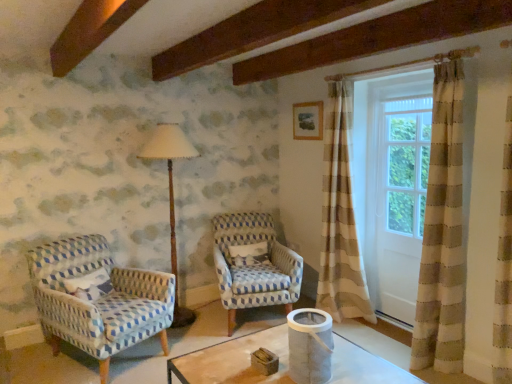
In order to face white fabric curtain at right, should I rotate leftwards or rightwards?

Rotate your view right by about 18.731°.

In order to face wooden floor lamp at left, should I rotate leftwards or rightwards?

To face it directly, rotate left by 11.015 degrees.

The image size is (512, 384). Describe the element at coordinates (98, 299) in the screenshot. I see `blue-patterned fabric chair at left, acting as the 2th chair starting from the right` at that location.

The width and height of the screenshot is (512, 384). What do you see at coordinates (253, 264) in the screenshot?
I see `blue and white woven chair at center, which appears as the 2th chair when viewed from the left` at bounding box center [253, 264].

What is the approximate width of blue and white woven chair at center, which appears as the 2th chair when viewed from the left?

blue and white woven chair at center, which appears as the 2th chair when viewed from the left, is 33.92 inches in width.

What is the approximate width of white wood screen door at right?

The width of white wood screen door at right is 4.09 inches.

Locate an element on the screen. This screenshot has width=512, height=384. white fabric curtain at right is located at coordinates (416, 197).

Is wooden picture frame at upper center situated inside white textured pillow at center or outside?

wooden picture frame at upper center lies outside white textured pillow at center.

Is wooden picture frame at upper center placed right next to white textured pillow at center?

No, wooden picture frame at upper center is not touching white textured pillow at center.

From the image's perspective, is wooden picture frame at upper center positioned above or below white textured pillow at center?

Clearly, from the image's perspective, wooden picture frame at upper center is above white textured pillow at center.

Where is `picture frame above the white textured pillow at center (from a real-world perspective)`? This screenshot has height=384, width=512. picture frame above the white textured pillow at center (from a real-world perspective) is located at coordinates (308, 121).

From the image's perspective, is wooden picture frame at upper center positioned above or below blue-patterned fabric chair at left, marked as the 1th chair in a left-to-right arrangement?

wooden picture frame at upper center is situated higher than blue-patterned fabric chair at left, marked as the 1th chair in a left-to-right arrangement, in the image.

Is wooden picture frame at upper center turned away from blue-patterned fabric chair at left, marked as the 1th chair in a left-to-right arrangement?

No, wooden picture frame at upper center is not facing away from blue-patterned fabric chair at left, marked as the 1th chair in a left-to-right arrangement.

From the image's perspective, which chair is the 2nd one below the wooden picture frame at upper center? Please provide its 2D coordinates.

[(98, 299)]

Between wooden picture frame at upper center and blue-patterned fabric chair at left, marked as the 1th chair in a left-to-right arrangement, which one has larger size?

With larger size is blue-patterned fabric chair at left, marked as the 1th chair in a left-to-right arrangement.

Is blue-patterned fabric chair at left, marked as the 1th chair in a left-to-right arrangement, oriented towards blue and white woven chair at center, which appears as the 2th chair when viewed from the left?

No, blue-patterned fabric chair at left, marked as the 1th chair in a left-to-right arrangement, is not turned towards blue and white woven chair at center, which appears as the 2th chair when viewed from the left.

Considering the relative positions of blue-patterned fabric chair at left, marked as the 1th chair in a left-to-right arrangement, and blue and white woven chair at center, which appears as the 2th chair when viewed from the left, in the image provided, is blue-patterned fabric chair at left, marked as the 1th chair in a left-to-right arrangement, to the left or to the right of blue and white woven chair at center, which appears as the 2th chair when viewed from the left,?

blue-patterned fabric chair at left, marked as the 1th chair in a left-to-right arrangement, is positioned on blue and white woven chair at center, which appears as the 2th chair when viewed from the left,'s left side.

Which of these two, blue-patterned fabric chair at left, marked as the 1th chair in a left-to-right arrangement, or blue and white woven chair at center, which appears as the 2th chair when viewed from the left, stands taller?

blue-patterned fabric chair at left, marked as the 1th chair in a left-to-right arrangement.

Is blue-patterned fabric chair at left, marked as the 1th chair in a left-to-right arrangement, thinner than blue and white woven chair at center, which appears as the 2th chair when viewed from the left?

In fact, blue-patterned fabric chair at left, marked as the 1th chair in a left-to-right arrangement, might be wider than blue and white woven chair at center, which appears as the 2th chair when viewed from the left.

At what (x,y) coordinates should I click in order to perform the action: click on window behind the blue-patterned fabric chair at left, marked as the 1th chair in a left-to-right arrangement. Please return your answer as a coordinate pair (x, y). The image size is (512, 384). Looking at the image, I should click on (416, 197).

Considering the sizes of objects white fabric curtain at right and blue-patterned fabric chair at left, marked as the 1th chair in a left-to-right arrangement, in the image provided, who is smaller, white fabric curtain at right or blue-patterned fabric chair at left, marked as the 1th chair in a left-to-right arrangement,?

Smaller between the two is white fabric curtain at right.

Is white fabric curtain at right aimed at blue-patterned fabric chair at left, acting as the 2th chair starting from the right?

No, white fabric curtain at right is not facing towards blue-patterned fabric chair at left, acting as the 2th chair starting from the right.

Is white fabric curtain at right touching wooden picture frame at upper center?

white fabric curtain at right is not next to wooden picture frame at upper center, and they're not touching.

Considering the sizes of objects white fabric curtain at right and wooden picture frame at upper center in the image provided, who is smaller, white fabric curtain at right or wooden picture frame at upper center?

wooden picture frame at upper center is smaller.

Between white fabric curtain at right and wooden picture frame at upper center, which one appears on the left side from the viewer's perspective?

wooden picture frame at upper center is more to the left.

Is blue and white woven chair at center, which appears as the 2th chair when viewed from the left, positioned with its back to white textured pillow at center?

Yes.

From the image's perspective, would you say blue and white woven chair at center, which appears as the 2th chair when viewed from the left, is positioned over white textured pillow at center?

No.

Considering the relative positions of blue and white woven chair at center, which appears as the 2th chair when viewed from the left, and white textured pillow at center in the image provided, is blue and white woven chair at center, which appears as the 2th chair when viewed from the left, to the right of white textured pillow at center from the viewer's perspective?

Indeed, blue and white woven chair at center, which appears as the 2th chair when viewed from the left, is positioned on the right side of white textured pillow at center.

Are blue and white woven chair at center, which appears as the 2th chair when viewed from the left, and white textured pillow at center far apart?

blue and white woven chair at center, which appears as the 2th chair when viewed from the left, is near white textured pillow at center, not far away.

Considering the sizes of wooden picture frame at upper center and blue and white woven chair at center, arranged as the 1th chair when viewed from the right, in the image, is wooden picture frame at upper center wider or thinner than blue and white woven chair at center, arranged as the 1th chair when viewed from the right,?

In the image, wooden picture frame at upper center appears to be more narrow than blue and white woven chair at center, arranged as the 1th chair when viewed from the right.

Is wooden picture frame at upper center oriented towards blue and white woven chair at center, arranged as the 1th chair when viewed from the right?

No.

From the image's perspective, is wooden picture frame at upper center beneath blue and white woven chair at center, which appears as the 2th chair when viewed from the left?

No, from the image's perspective, wooden picture frame at upper center is not below blue and white woven chair at center, which appears as the 2th chair when viewed from the left.

From a real-world perspective, relative to blue and white woven chair at center, which appears as the 2th chair when viewed from the left, is wooden picture frame at upper center vertically above or below?

Clearly, from a real-world perspective, wooden picture frame at upper center is above blue and white woven chair at center, which appears as the 2th chair when viewed from the left.

The height and width of the screenshot is (384, 512). I want to click on pillow lying in front of the wooden picture frame at upper center, so click(248, 254).

From the image's perspective, starting from the wooden picture frame at upper center, which chair is the 2nd one below? Please provide its 2D coordinates.

[(98, 299)]

When comparing their distances from wooden floor lamp at left, does blue and white woven chair at center, which appears as the 2th chair when viewed from the left, or blue-patterned fabric chair at left, acting as the 2th chair starting from the right, seem closer?

blue and white woven chair at center, which appears as the 2th chair when viewed from the left, is positioned closer to the anchor wooden floor lamp at left.

Looking at the image, which one is located closer to blue-patterned fabric chair at left, marked as the 1th chair in a left-to-right arrangement, white textured pillow at center or wooden picture frame at upper center?

white textured pillow at center.

Which object lies further to the anchor point white wood screen door at right, blue and white woven chair at center, which appears as the 2th chair when viewed from the left, or wooden floor lamp at left?

wooden floor lamp at left is further to white wood screen door at right.

Which object lies nearer to the anchor point wooden picture frame at upper center, blue-patterned fabric chair at left, acting as the 2th chair starting from the right, or white fabric curtain at right?

white fabric curtain at right is closer to wooden picture frame at upper center.

Considering their positions, is wooden floor lamp at left positioned closer to wooden picture frame at upper center than white wood screen door at right?

white wood screen door at right is positioned closer to the anchor wooden picture frame at upper center.

From the image, which object appears to be farther from white wood screen door at right, wooden picture frame at upper center or blue and white woven chair at center, arranged as the 1th chair when viewed from the right?

blue and white woven chair at center, arranged as the 1th chair when viewed from the right, is positioned further to the anchor white wood screen door at right.

Estimate the real-world distances between objects in this image. Which object is further from wooden picture frame at upper center, white textured pillow at center or blue and white woven chair at center, which appears as the 2th chair when viewed from the left?

Among the two, white textured pillow at center is located further to wooden picture frame at upper center.

Looking at the image, which one is located closer to wooden floor lamp at left, white textured pillow at center or blue-patterned fabric chair at left, marked as the 1th chair in a left-to-right arrangement?

white textured pillow at center lies closer to wooden floor lamp at left than the other object.

Identify the location of chair between blue-patterned fabric chair at left, marked as the 1th chair in a left-to-right arrangement, and white wood screen door at right. (253, 264).

Where is `pillow located between wooden floor lamp at left and white fabric curtain at right in the left-right direction`? The height and width of the screenshot is (384, 512). pillow located between wooden floor lamp at left and white fabric curtain at right in the left-right direction is located at coordinates (248, 254).

Identify the location of picture frame situated between wooden floor lamp at left and white fabric curtain at right from left to right. (308, 121).

Locate an element on the screen. The width and height of the screenshot is (512, 384). pillow between blue-patterned fabric chair at left, marked as the 1th chair in a left-to-right arrangement, and white wood screen door at right, in the horizontal direction is located at coordinates (248, 254).